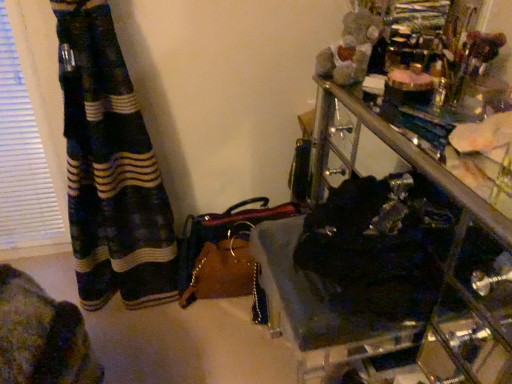
Question: Is leather handbag at lower center located outside black fabric at center?

Choices:
 (A) yes
 (B) no

Answer: (A)

Question: Does leather handbag at lower center appear on the right side of black fabric at center?

Choices:
 (A) yes
 (B) no

Answer: (B)

Question: Can you confirm if leather handbag at lower center is positioned to the left of black fabric at center?

Choices:
 (A) yes
 (B) no

Answer: (A)

Question: From the image's perspective, is leather handbag at lower center under black fabric at center?

Choices:
 (A) yes
 (B) no

Answer: (A)

Question: Is leather handbag at lower center oriented away from black fabric at center?

Choices:
 (A) no
 (B) yes

Answer: (A)

Question: Can you confirm if leather handbag at lower center is wider than black fabric at center?

Choices:
 (A) no
 (B) yes

Answer: (B)

Question: Is black fabric at center not near leather handbag at lower center?

Choices:
 (A) no
 (B) yes

Answer: (A)

Question: Is leather handbag at lower center at the back of black fabric at center?

Choices:
 (A) yes
 (B) no

Answer: (B)

Question: Is leather handbag at lower center completely or partially inside black fabric at center?

Choices:
 (A) yes
 (B) no

Answer: (B)

Question: Can you confirm if black fabric at center is wider than leather handbag at lower center?

Choices:
 (A) yes
 (B) no

Answer: (B)

Question: Can you confirm if black fabric at center is smaller than leather handbag at lower center?

Choices:
 (A) no
 (B) yes

Answer: (B)

Question: From the image's perspective, would you say black fabric at center is shown under leather handbag at lower center?

Choices:
 (A) no
 (B) yes

Answer: (A)

Question: Considering their positions, is black fabric at center located in front of or behind leather handbag at lower center?

Choices:
 (A) front
 (B) behind

Answer: (A)